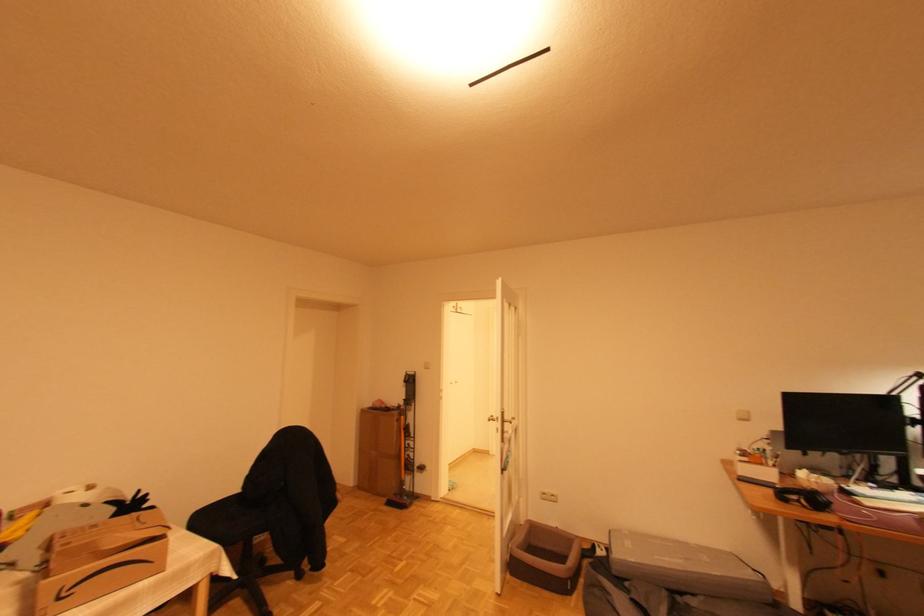
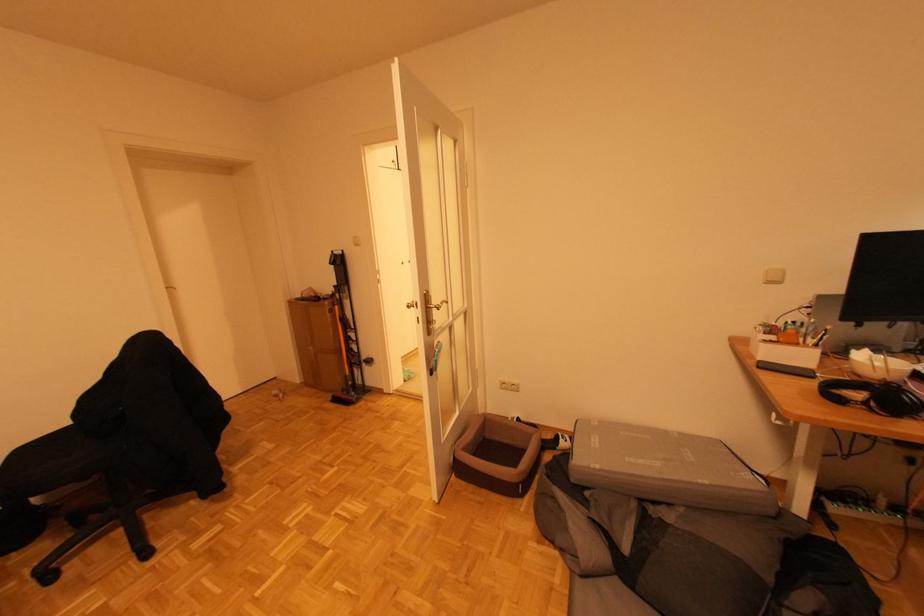
In a continuous first-person perspective shot, in which direction is the camera moving?

The cameraman walked toward right, forward.